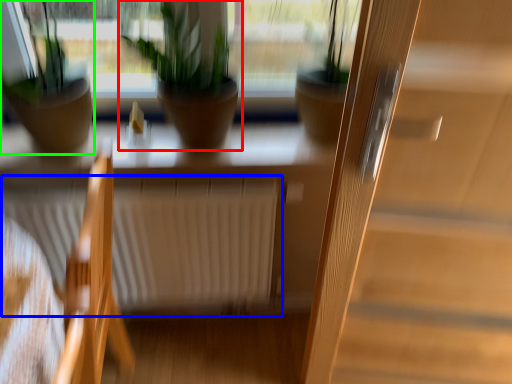
Question: Considering the real-world distances, which object is closest to houseplant (highlighted by a red box)? radiator (highlighted by a blue box) or houseplant (highlighted by a green box).

Choices:
 (A) radiator
 (B) houseplant

Answer: (B)